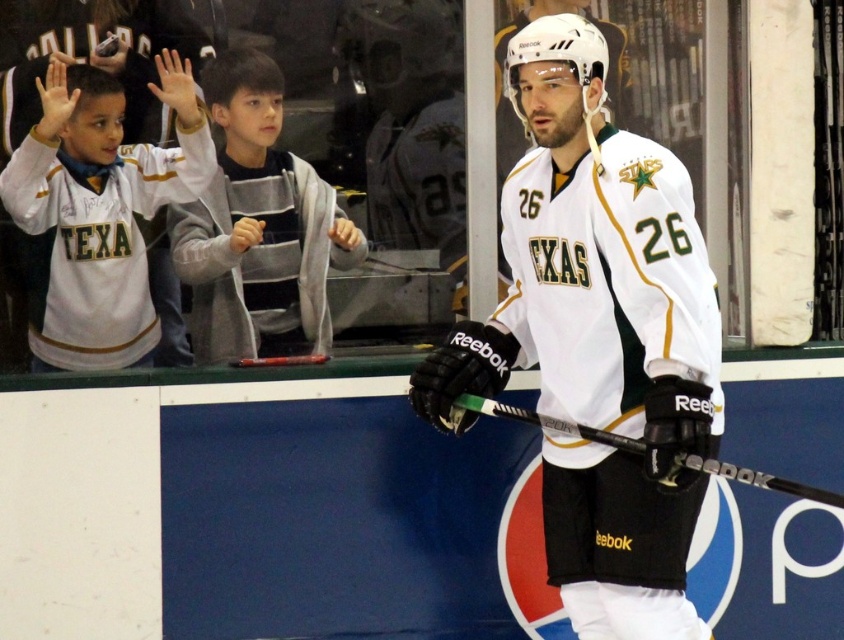
Question: Does white jersey at upper left appear on the left side of gray striped sweater at upper left?

Choices:
 (A) no
 (B) yes

Answer: (B)

Question: Which point is closer to the camera?

Choices:
 (A) (778, 477)
 (B) (134, 349)
 (C) (279, 225)
 (D) (655, 538)

Answer: (D)

Question: Estimate the real-world distances between objects in this image. Which object is farther from the white jersey at upper left?

Choices:
 (A) gray striped sweater at upper left
 (B) white matte jersey at center
 (C) black matte hockey stick at center

Answer: (C)

Question: Which of the following is the farthest from the observer?

Choices:
 (A) gray striped sweater at upper left
 (B) white jersey at upper left
 (C) black matte hockey stick at center
 (D) white matte jersey at center

Answer: (A)

Question: Is white jersey at upper left positioned at the back of black matte hockey stick at center?

Choices:
 (A) no
 (B) yes

Answer: (B)

Question: Does white jersey at upper left appear over gray striped sweater at upper left?

Choices:
 (A) yes
 (B) no

Answer: (B)